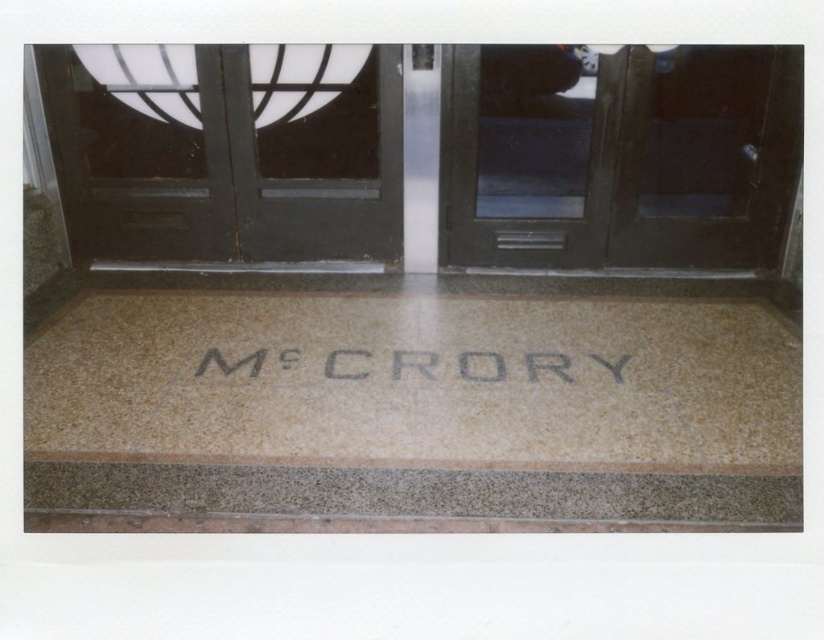
Looking at this image, which is below, transparent glass door at center or matte black door at center?

transparent glass door at center is below.

Is transparent glass door at center above matte black door at center?

Actually, transparent glass door at center is below matte black door at center.

Is point (649, 182) positioned behind point (520, 170)?

No, (649, 182) is in front of (520, 170).

At what (x,y) coordinates should I click in order to perform the action: click on transparent glass door at center. Please return your answer as a coordinate pair (x, y). Looking at the image, I should click on (620, 156).

Between clear glass door at center and transparent glass door at center, which one has less height?

transparent glass door at center is shorter.

Is clear glass door at center further to the viewer compared to transparent glass door at center?

Yes, it is.

Locate an element on the screen. clear glass door at center is located at coordinates (227, 150).

Find the location of a particular element. clear glass door at center is located at coordinates (227, 150).

Measure the distance from clear glass door at center to matte black door at center.

clear glass door at center is 36.19 inches away from matte black door at center.

Who is positioned more to the left, clear glass door at center or matte black door at center?

clear glass door at center

The image size is (824, 640). Describe the element at coordinates (227, 150) in the screenshot. I see `clear glass door at center` at that location.

The width and height of the screenshot is (824, 640). In order to click on clear glass door at center in this screenshot , I will do `click(227, 150)`.